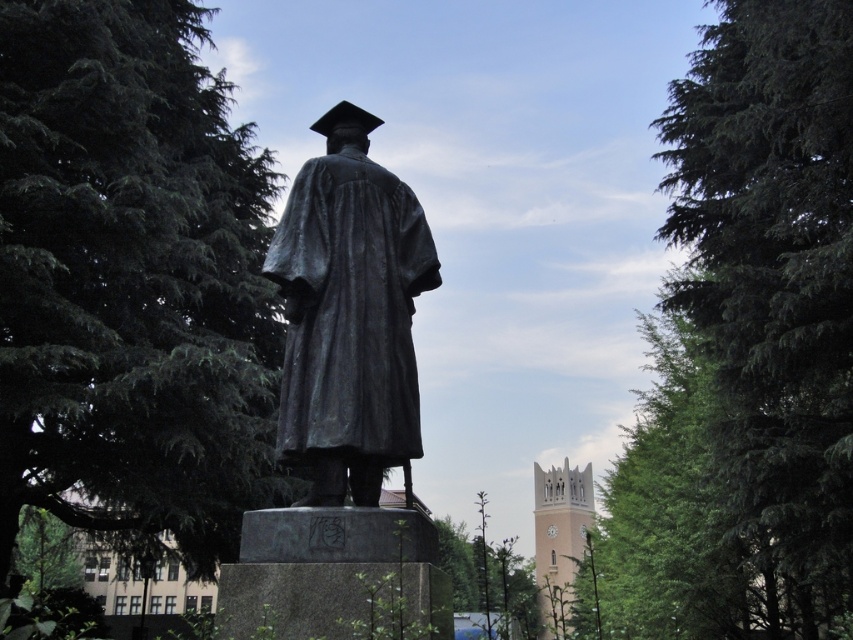
You are an artist planning to sketch the scene. You have a small sketchbook and want to ensure you can capture both the green textured leaves at upper left and the green textured tree at right without overcrowding the page. Which object should you draw first to maintain proportion and detail?

You should draw the green textured leaves at upper left first because it is thinner than the green textured tree at right, allowing you to reserve space for the larger tree while maintaining proportions.

You are standing in front of the bronze statue facing the same direction as the statue is looking. You notice a point marked at coordinates (131,276). What object is located at that point?

The point at (131,276) marks green textured leaves at upper left.